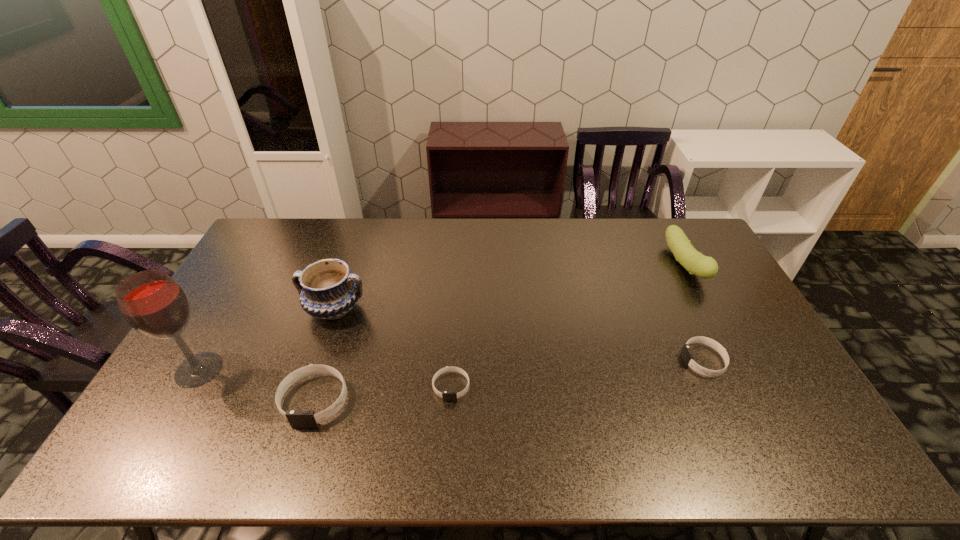
Find the location of a particular element. Image resolution: width=960 pixels, height=540 pixels. the fourth tallest object is located at coordinates (297, 418).

The width and height of the screenshot is (960, 540). I want to click on the tallest wristband, so click(297, 418).

At what (x,y) coordinates should I click in order to perform the action: click on the shortest object. Please return your answer as a coordinate pair (x, y). The height and width of the screenshot is (540, 960). Looking at the image, I should click on (446, 395).

You are a GUI agent. You are given a task and a screenshot of the screen. Output one action in this format:
    pyautogui.click(x=<x>, y=<y>)
    Task: Click on the shortest wristband
    The height and width of the screenshot is (540, 960).
    Given the screenshot: What is the action you would take?
    pyautogui.click(x=446, y=395)

I want to click on the rightmost wristband, so click(687, 356).

You are a GUI agent. You are given a task and a screenshot of the screen. Output one action in this format:
    pyautogui.click(x=<x>, y=<y>)
    Task: Click on the second shortest wristband
    This screenshot has width=960, height=540.
    Given the screenshot: What is the action you would take?
    pyautogui.click(x=687, y=356)

Find the location of `alcohol`. alcohol is located at coordinates (154, 304).

The image size is (960, 540). In order to click on the leftmost object in this screenshot , I will do `click(154, 304)`.

Locate an element on the screen. The width and height of the screenshot is (960, 540). the fourth shortest object is located at coordinates (696, 263).

At what (x,y) coordinates should I click in order to perform the action: click on pottery. Please return your answer as a coordinate pair (x, y). The width and height of the screenshot is (960, 540). Looking at the image, I should click on (327, 290).